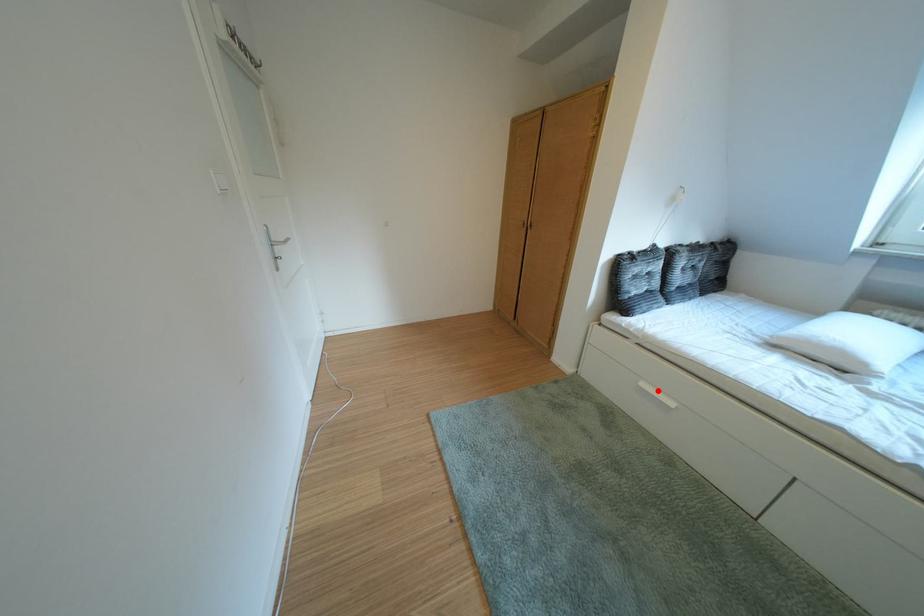
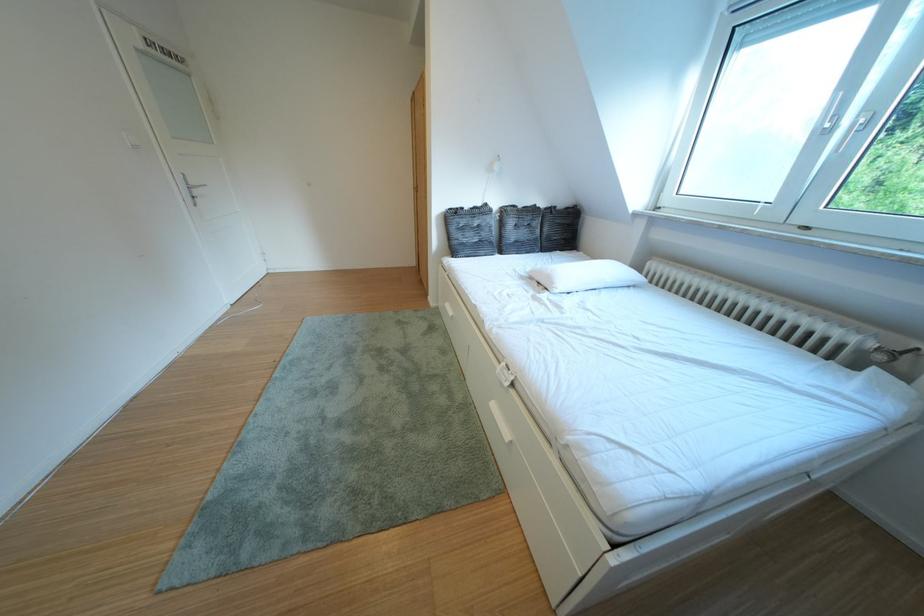
Find the pixel in the second image that matches the highlighted location in the first image.

(460, 310)